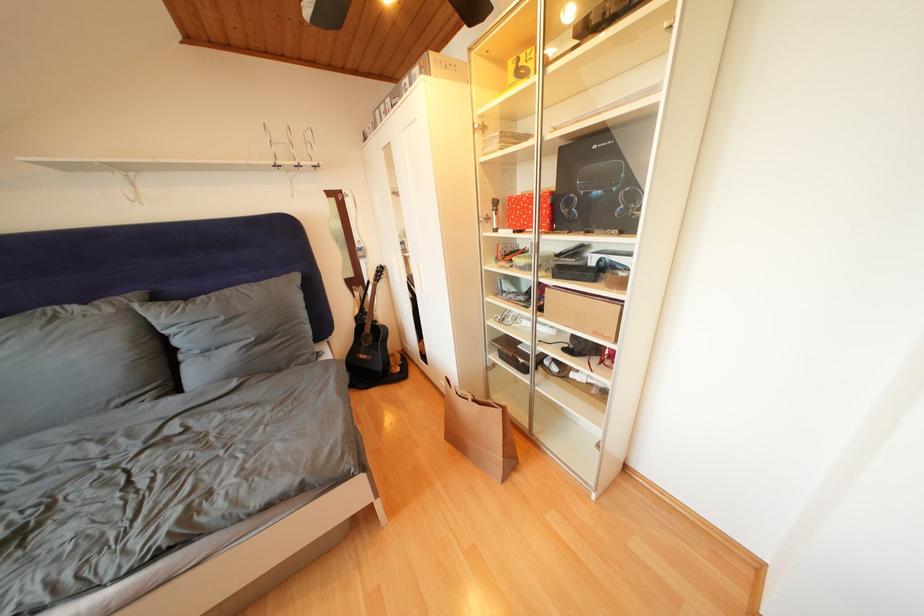
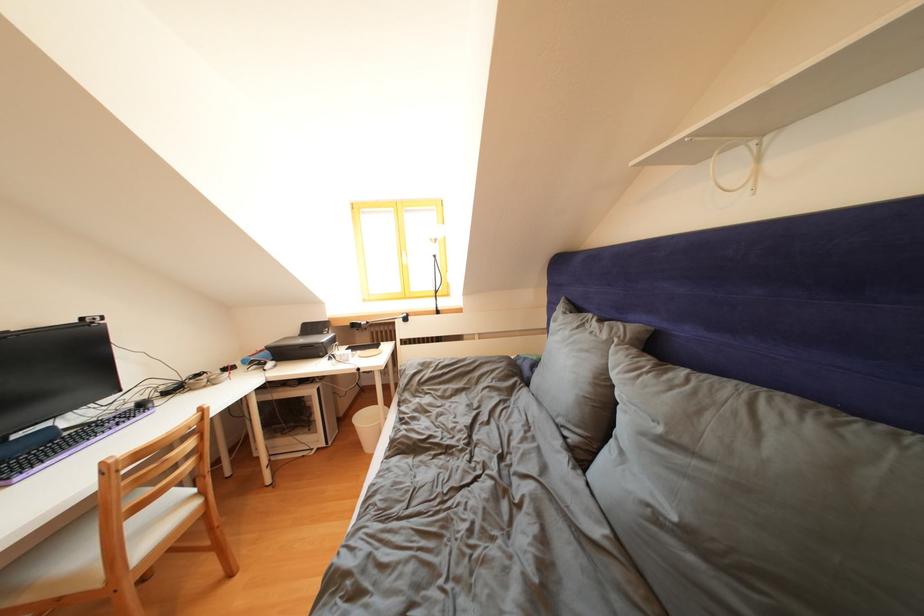
In the second image, find the point that corresponds to pixel 231 323 in the first image.

(667, 435)